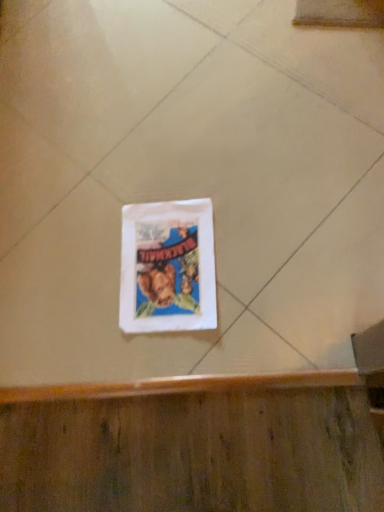
Describe the element at coordinates (245, 160) in the screenshot. This screenshot has height=512, width=384. I see `white paper bag at center` at that location.

I want to click on white paper bag at center, so click(245, 160).

Find the location of `white paper bag at center`. white paper bag at center is located at coordinates (168, 267).

Measure the distance between point [190,247] and camera.

The depth of point [190,247] is 37.44 inches.

Describe the element at coordinates (168, 267) in the screenshot. Image resolution: width=384 pixels, height=512 pixels. I see `white paper bag at center` at that location.

Image resolution: width=384 pixels, height=512 pixels. Find the location of `white paper bag at center`. white paper bag at center is located at coordinates (245, 160).

Is white paper bag at center at the left side of white paper bag at center?

Indeed, white paper bag at center is positioned on the left side of white paper bag at center.

Considering the positions of objects white paper bag at center and white paper bag at center in the image provided, who is in front, white paper bag at center or white paper bag at center?

Positioned in front is white paper bag at center.

Is point (161, 328) more distant than point (127, 176)?

No, it is in front of (127, 176).

From the image's perspective, between white paper bag at center and white paper bag at center, who is located below?

white paper bag at center.

From a real-world perspective, which object stands above the other?

In real-world perspective, white paper bag at center is above.

Can you confirm if white paper bag at center is wider than white paper bag at center?

No.

Considering the relative sizes of white paper bag at center and white paper bag at center in the image provided, is white paper bag at center shorter than white paper bag at center?

Correct, white paper bag at center is not as tall as white paper bag at center.

Is white paper bag at center bigger than white paper bag at center?

No.

Is white paper bag at center inside or outside of white paper bag at center?

white paper bag at center lies within the bounds of white paper bag at center.

Is white paper bag at center next to white paper bag at center and touching it?

No, white paper bag at center is not making contact with white paper bag at center.

Does white paper bag at center turn towards white paper bag at center?

Yes.

This screenshot has height=512, width=384. What are the coordinates of `ceramic tile lying in front of the white paper bag at center` in the screenshot? It's located at (245, 160).

Considering the positions of objects white paper bag at center and white paper bag at center in the image provided, who is more to the right, white paper bag at center or white paper bag at center?

From the viewer's perspective, white paper bag at center appears more on the right side.

Is the position of white paper bag at center more distant than that of white paper bag at center?

That is False.

Which is behind, point (240, 102) or point (206, 218)?

The point (240, 102) is farther from the camera.

From the image's perspective, which one is positioned lower, white paper bag at center or white paper bag at center?

white paper bag at center.

From a real-world perspective, which object rests below the other?

From a 3D spatial view, white paper bag at center is below.

Which object is thinner, white paper bag at center or white paper bag at center?

white paper bag at center is thinner.

Between white paper bag at center and white paper bag at center, which one has more height?

white paper bag at center.

Does white paper bag at center have a smaller size compared to white paper bag at center?

Incorrect, white paper bag at center is not smaller in size than white paper bag at center.

Is white paper bag at center spatially inside white paper bag at center, or outside of it?

white paper bag at center exists outside the volume of white paper bag at center.

Would you say white paper bag at center is a long distance from white paper bag at center?

They are positioned close to each other.

Is white paper bag at center turned away from white paper bag at center?

That's not correct — white paper bag at center is not looking away from white paper bag at center.

In the scene shown: How much distance is there between white paper bag at center and white paper bag at center?

6.67 inches.

Where is `ceramic tile in front of the white paper bag at center`? ceramic tile in front of the white paper bag at center is located at coordinates (245, 160).

I want to click on ceramic tile in front of the white paper bag at center, so click(x=245, y=160).

The height and width of the screenshot is (512, 384). Find the location of `ceramic tile lying above the white paper bag at center (from the image's perspective)`. ceramic tile lying above the white paper bag at center (from the image's perspective) is located at coordinates (245, 160).